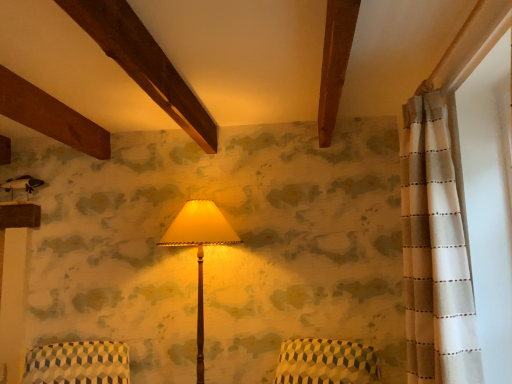
Question: Considering their positions, is patterned fabric armchair at lower left located in front of or behind wooden floor lamp at center?

Choices:
 (A) front
 (B) behind

Answer: (A)

Question: Is patterned fabric armchair at lower left bigger or smaller than wooden floor lamp at center?

Choices:
 (A) big
 (B) small

Answer: (B)

Question: Estimate the real-world distances between objects in this image. Which object is closer to the wooden floor lamp at center?

Choices:
 (A) patterned fabric armchair at lower left
 (B) white dotted fabric at right

Answer: (A)

Question: Estimate the real-world distances between objects in this image. Which object is closer to the patterned fabric armchair at lower left?

Choices:
 (A) wooden floor lamp at center
 (B) white dotted fabric at right

Answer: (A)